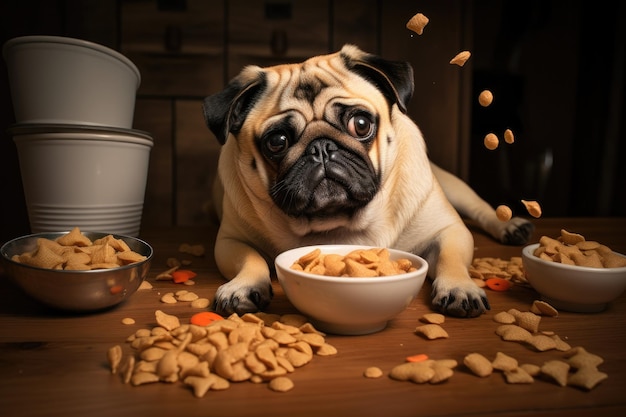
Locate an element on the screen. This screenshot has height=417, width=626. bowls is located at coordinates (57, 287), (327, 290), (578, 279).